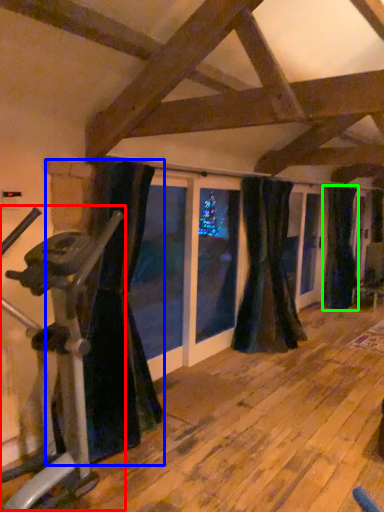
Question: Which object is the closest to the stationary bicycle (highlighted by a red box)? Choose among these: curtain (highlighted by a blue box) or curtain (highlighted by a green box).

Choices:
 (A) curtain
 (B) curtain

Answer: (A)